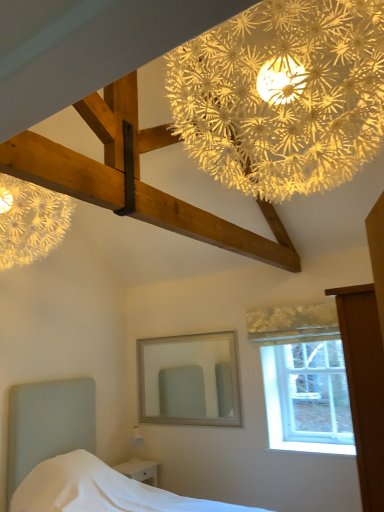
Question: Is white fabric bed at lower left bigger than white glossy nightstand at lower left?

Choices:
 (A) yes
 (B) no

Answer: (A)

Question: Is white fabric bed at lower left positioned with its back to white glossy nightstand at lower left?

Choices:
 (A) no
 (B) yes

Answer: (A)

Question: Is white fabric bed at lower left aimed at white glossy nightstand at lower left?

Choices:
 (A) no
 (B) yes

Answer: (A)

Question: Is white fabric bed at lower left smaller than white glossy nightstand at lower left?

Choices:
 (A) no
 (B) yes

Answer: (A)

Question: Is the depth of white fabric bed at lower left less than that of white glossy nightstand at lower left?

Choices:
 (A) yes
 (B) no

Answer: (A)

Question: From the image's perspective, is white fabric bed at lower left located above white glossy nightstand at lower left?

Choices:
 (A) no
 (B) yes

Answer: (B)

Question: Is clear glass window at upper right smaller than white glossy nightstand at lower left?

Choices:
 (A) no
 (B) yes

Answer: (B)

Question: Is clear glass window at upper right completely or partially outside of white glossy nightstand at lower left?

Choices:
 (A) yes
 (B) no

Answer: (A)

Question: Is clear glass window at upper right wider than white glossy nightstand at lower left?

Choices:
 (A) no
 (B) yes

Answer: (A)

Question: Is clear glass window at upper right at the left side of white glossy nightstand at lower left?

Choices:
 (A) no
 (B) yes

Answer: (A)

Question: Is white glossy nightstand at lower left completely or partially inside clear glass window at upper right?

Choices:
 (A) no
 (B) yes

Answer: (A)

Question: Does clear glass window at upper right appear on the right side of white glossy nightstand at lower left?

Choices:
 (A) yes
 (B) no

Answer: (A)

Question: From a real-world perspective, is illuminated paper flower at upper center located beneath white fabric bed at lower left?

Choices:
 (A) yes
 (B) no

Answer: (B)